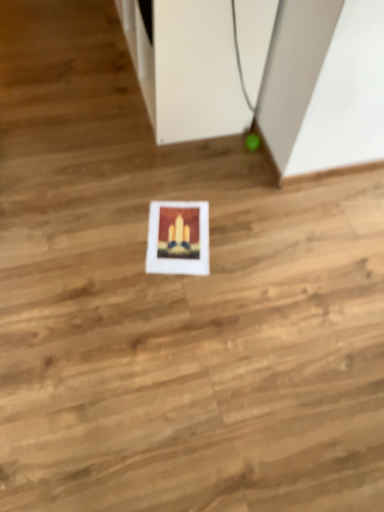
The width and height of the screenshot is (384, 512). What are the coordinates of `free space to the left of white glossy cabinet at upper center` in the screenshot? It's located at (49, 67).